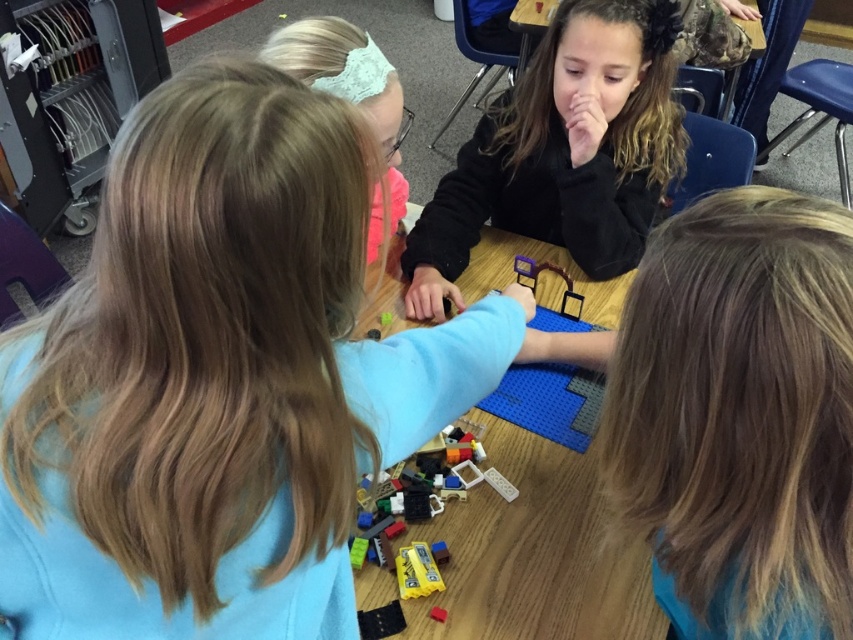
Question: Which point is closer to the camera?

Choices:
 (A) light blue lace headband at upper center
 (B) translucent plastic toy at center
 (C) black matte jacket at center

Answer: (A)

Question: Can you confirm if smooth plastic lego at center is bigger than translucent plastic lego pieces at lower center?

Choices:
 (A) yes
 (B) no

Answer: (A)

Question: Is blue plastic table at center wider than light blue lace headband at upper center?

Choices:
 (A) no
 (B) yes

Answer: (B)

Question: Which object is farther from the camera taking this photo?

Choices:
 (A) smooth plastic lego at center
 (B) blonde hair at lower right
 (C) light blue lace headband at upper center
 (D) black matte jacket at center

Answer: (D)

Question: Does translucent plastic lego pieces at lower center appear on the left side of translucent plastic toy at center?

Choices:
 (A) yes
 (B) no

Answer: (A)

Question: Which of the following is the closest to the observer?

Choices:
 (A) light blue lace headband at upper center
 (B) black matte jacket at center
 (C) blonde hair at lower right

Answer: (C)